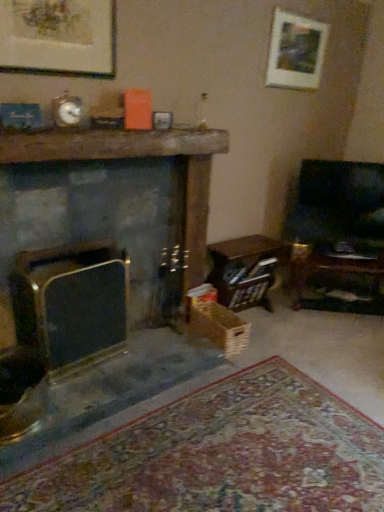
Question: Can you confirm if matte black fireplace at left, which is the first fireplace from left to right, is positioned to the right of matte gold picture frame at upper left, which appears as the 2th picture frame when viewed from the right?

Choices:
 (A) yes
 (B) no

Answer: (A)

Question: Is matte black fireplace at left, which is the first fireplace from left to right, thinner than matte gold picture frame at upper left, arranged as the 2th picture frame when viewed from the back?

Choices:
 (A) no
 (B) yes

Answer: (A)

Question: Considering the relative sizes of matte black fireplace at left, which is the first fireplace from left to right, and matte gold picture frame at upper left, the 1th picture frame ordered from the bottom, in the image provided, is matte black fireplace at left, which is the first fireplace from left to right, smaller than matte gold picture frame at upper left, the 1th picture frame ordered from the bottom,?

Choices:
 (A) yes
 (B) no

Answer: (B)

Question: Is matte gold picture frame at upper left, which is the 2th picture frame in top-to-bottom order, inside matte black fireplace at left, which is the first fireplace from left to right?

Choices:
 (A) yes
 (B) no

Answer: (B)

Question: Is matte black fireplace at left, the second fireplace positioned from the right, looking in the opposite direction of matte gold picture frame at upper left, arranged as the 2th picture frame when viewed from the back?

Choices:
 (A) yes
 (B) no

Answer: (B)

Question: Considering the relative sizes of matte black fireplace at left, which is the first fireplace from left to right, and matte gold picture frame at upper left, the 1th picture frame ordered from the bottom, in the image provided, is matte black fireplace at left, which is the first fireplace from left to right, shorter than matte gold picture frame at upper left, the 1th picture frame ordered from the bottom,?

Choices:
 (A) no
 (B) yes

Answer: (A)

Question: From a real-world perspective, is dark gray stone fireplace at center, placed as the 1th fireplace when sorted from right to left, below matte black fireplace at left, the second fireplace positioned from the right?

Choices:
 (A) no
 (B) yes

Answer: (A)

Question: Is dark gray stone fireplace at center, placed as the 1th fireplace when sorted from right to left, far from matte black fireplace at left, the second fireplace positioned from the right?

Choices:
 (A) no
 (B) yes

Answer: (A)

Question: Can you confirm if dark gray stone fireplace at center, placed as the 1th fireplace when sorted from right to left, is positioned to the left of matte black fireplace at left, which is the first fireplace from left to right?

Choices:
 (A) no
 (B) yes

Answer: (A)

Question: From a real-world perspective, is dark gray stone fireplace at center, which is the second fireplace in left-to-right order, located higher than matte black fireplace at left, which is the first fireplace from left to right?

Choices:
 (A) no
 (B) yes

Answer: (B)

Question: From the image's perspective, does dark gray stone fireplace at center, placed as the 1th fireplace when sorted from right to left, appear lower than matte black fireplace at left, the second fireplace positioned from the right?

Choices:
 (A) no
 (B) yes

Answer: (A)

Question: Is dark gray stone fireplace at center, which is the second fireplace in left-to-right order, wider than matte black fireplace at left, which is the first fireplace from left to right?

Choices:
 (A) yes
 (B) no

Answer: (A)

Question: From a real-world perspective, does matte black fireplace at left, which is the first fireplace from left to right, sit lower than white matte picture frame at upper right, which is counted as the 1th picture frame, starting from the top?

Choices:
 (A) yes
 (B) no

Answer: (A)